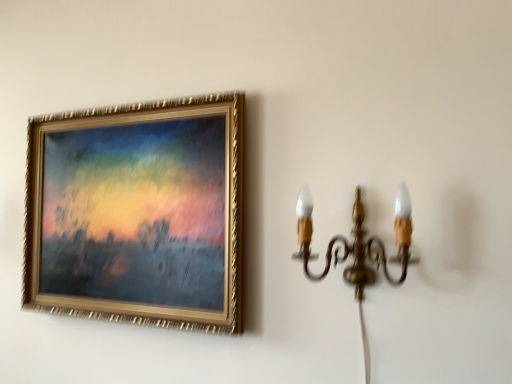
Question: Should I look upward or downward to see gold-framed painting at upper left?

Choices:
 (A) down
 (B) up

Answer: (A)

Question: From the image's perspective, is gold brass wall sconce at right below gold-framed painting at upper left?

Choices:
 (A) no
 (B) yes

Answer: (B)

Question: Is gold-framed painting at upper left a part of gold brass wall sconce at right?

Choices:
 (A) yes
 (B) no

Answer: (B)

Question: Is gold brass wall sconce at right shorter than gold-framed painting at upper left?

Choices:
 (A) yes
 (B) no

Answer: (A)

Question: Does gold brass wall sconce at right have a smaller size compared to gold-framed painting at upper left?

Choices:
 (A) no
 (B) yes

Answer: (B)

Question: From the image's perspective, is gold brass wall sconce at right located above gold-framed painting at upper left?

Choices:
 (A) no
 (B) yes

Answer: (A)

Question: Is gold brass wall sconce at right not within gold-framed painting at upper left?

Choices:
 (A) no
 (B) yes

Answer: (B)

Question: Could gold brass wall sconce at right be considered to be inside gold-framed painting at upper left?

Choices:
 (A) no
 (B) yes

Answer: (A)

Question: Is there a large distance between gold-framed painting at upper left and gold brass wall sconce at right?

Choices:
 (A) yes
 (B) no

Answer: (B)

Question: Is gold-framed painting at upper left not inside gold brass wall sconce at right?

Choices:
 (A) no
 (B) yes

Answer: (B)

Question: Is gold-framed painting at upper left smaller than gold brass wall sconce at right?

Choices:
 (A) no
 (B) yes

Answer: (A)

Question: Considering the relative sizes of gold-framed painting at upper left and gold brass wall sconce at right in the image provided, is gold-framed painting at upper left shorter than gold brass wall sconce at right?

Choices:
 (A) no
 (B) yes

Answer: (A)

Question: Does gold-framed painting at upper left appear on the right side of gold brass wall sconce at right?

Choices:
 (A) yes
 (B) no

Answer: (B)

Question: Considering their positions, is gold-framed painting at upper left located in front of or behind gold brass wall sconce at right?

Choices:
 (A) front
 (B) behind

Answer: (B)